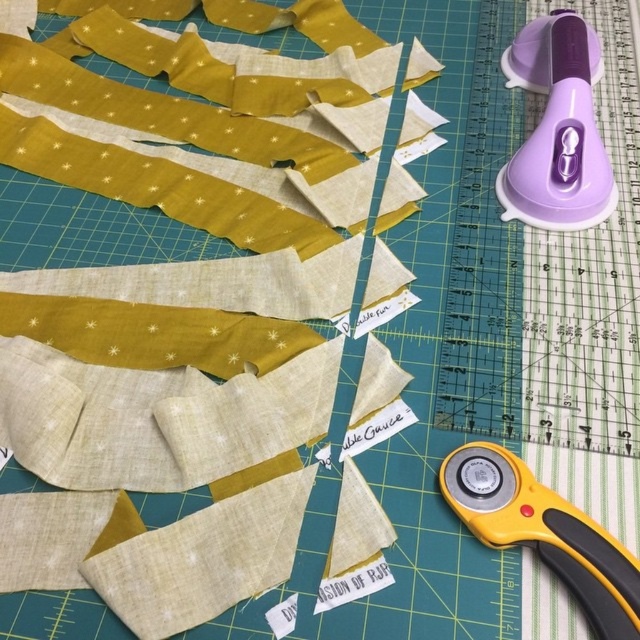
Between point (221, 372) and point (596, 545), which one is positioned in front?

Point (596, 545)

Image resolution: width=640 pixels, height=640 pixels. Describe the element at coordinates (147, 436) in the screenshot. I see `matte yellow fabric at upper left` at that location.

Where is `matte yellow fabric at upper left`? matte yellow fabric at upper left is located at coordinates (147, 436).

Is purple plastic rotary cutter at upper right further to the viewer compared to yellow plastic rotary cutter at lower right?

Yes, it is.

Can you confirm if purple plastic rotary cutter at upper right is positioned above yellow plastic rotary cutter at lower right?

Yes, purple plastic rotary cutter at upper right is above yellow plastic rotary cutter at lower right.

Which is in front, point (547, 200) or point (580, 576)?

Point (580, 576)

Locate an element on the screen. Image resolution: width=640 pixels, height=640 pixels. purple plastic rotary cutter at upper right is located at coordinates (557, 129).

Which of these two, matte yellow fabric at upper left or purple plastic rotary cutter at upper right, stands shorter?

Standing shorter between the two is purple plastic rotary cutter at upper right.

Can you confirm if matte yellow fabric at upper left is shorter than purple plastic rotary cutter at upper right?

Incorrect, matte yellow fabric at upper left's height does not fall short of purple plastic rotary cutter at upper right's.

I want to click on matte yellow fabric at upper left, so click(147, 436).